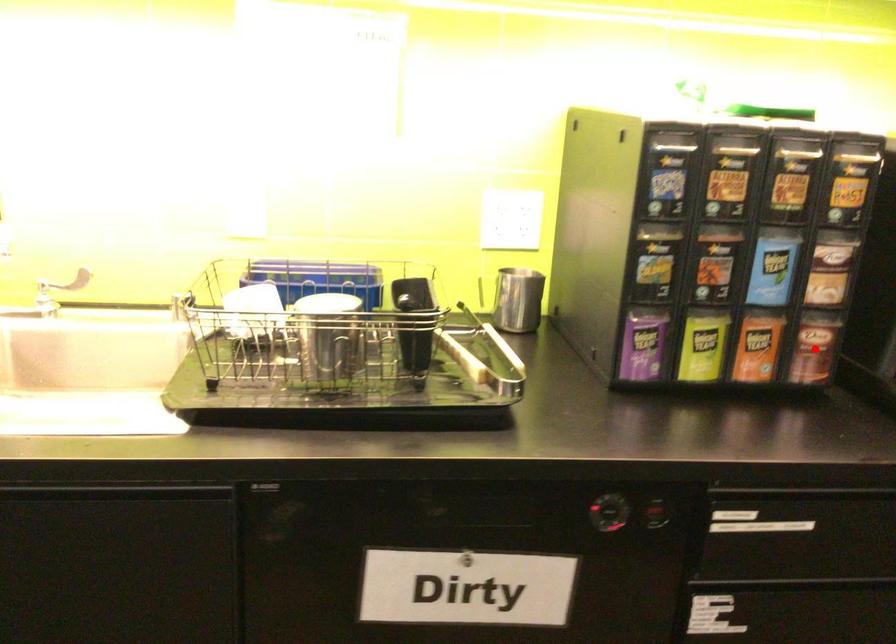
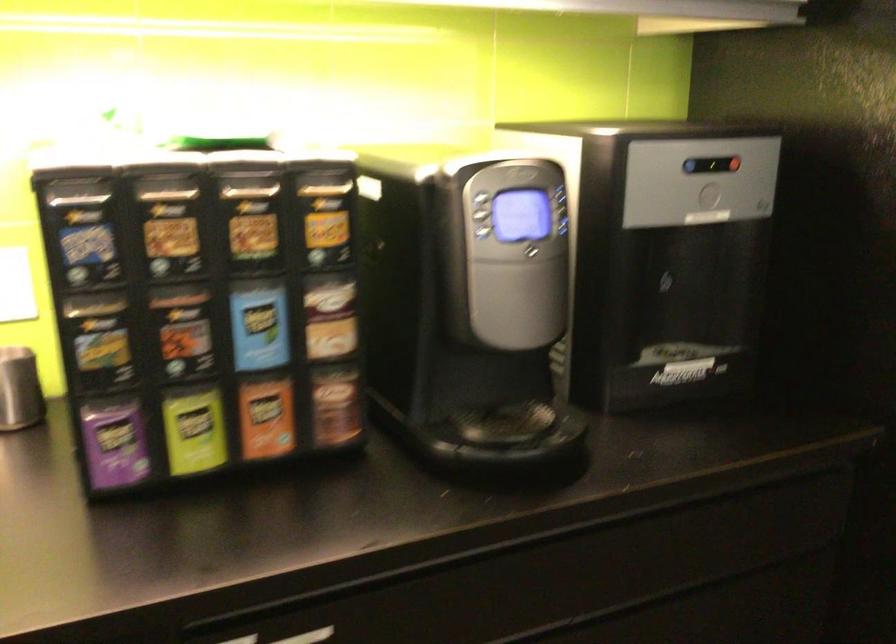
Question: I am providing you with two images of the same scene from different viewpoints. A red point is shown in image1. For the corresponding object point in image2, is it positioned nearer or farther from the camera?

Choices:
 (A) Nearer
 (B) Farther

Answer: (A)